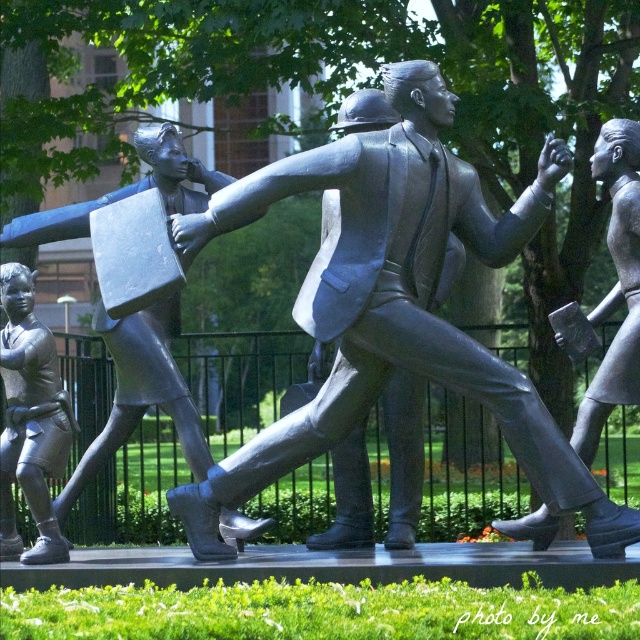
You are standing at the center of the sculpture and want to locate the brushed metal boy at lower left. Based on the coordinates provided, in which direction should you look to find it?

The brushed metal boy at lower left is located at coordinates point (33, 412), so you should look to your lower left direction to find it.

You are a tour guide leading a group to a bronze statue at left and a polished bronze statue at right. The path between them is narrow. If the statues are 4.05 meters apart, can a tour group of 10 people walk between them in a single file line?

The bronze statue at left and polished bronze statue at right are 4.05 meters apart from each other. A single file line of 10 people typically requires about 3 meters of space, so the 4.05 meters between them is sufficient for the group to pass through in a single file line.